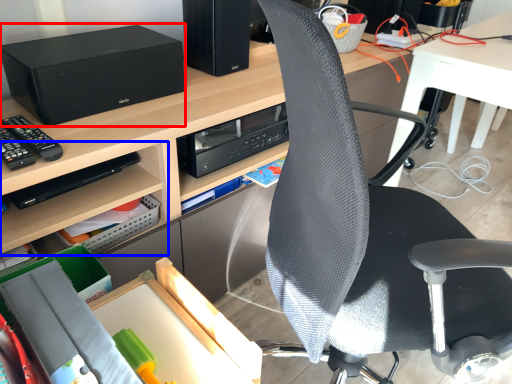
Question: Among these objects, which one is farthest to the camera, stereo (highlighted by a red box) or shelf (highlighted by a blue box)?

Choices:
 (A) stereo
 (B) shelf

Answer: (B)